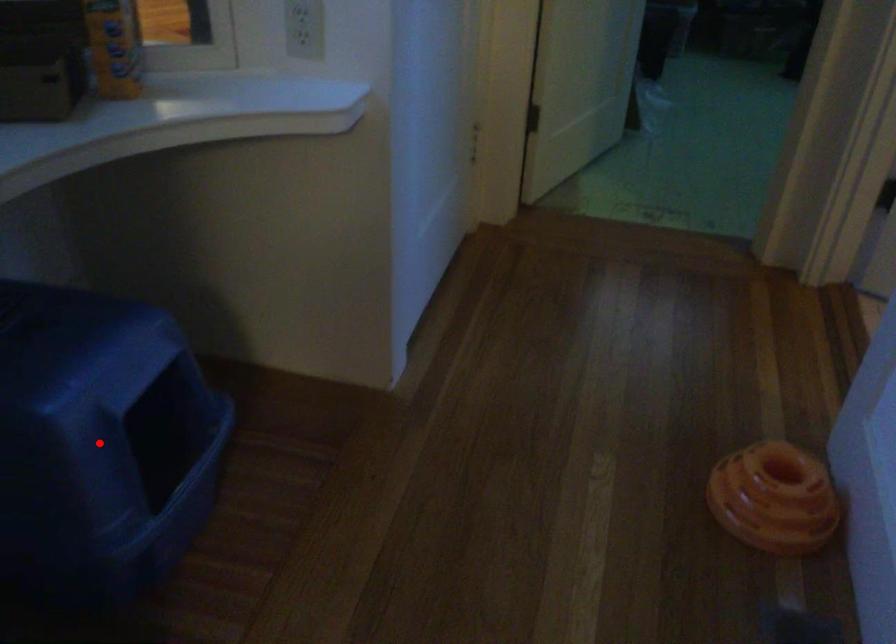
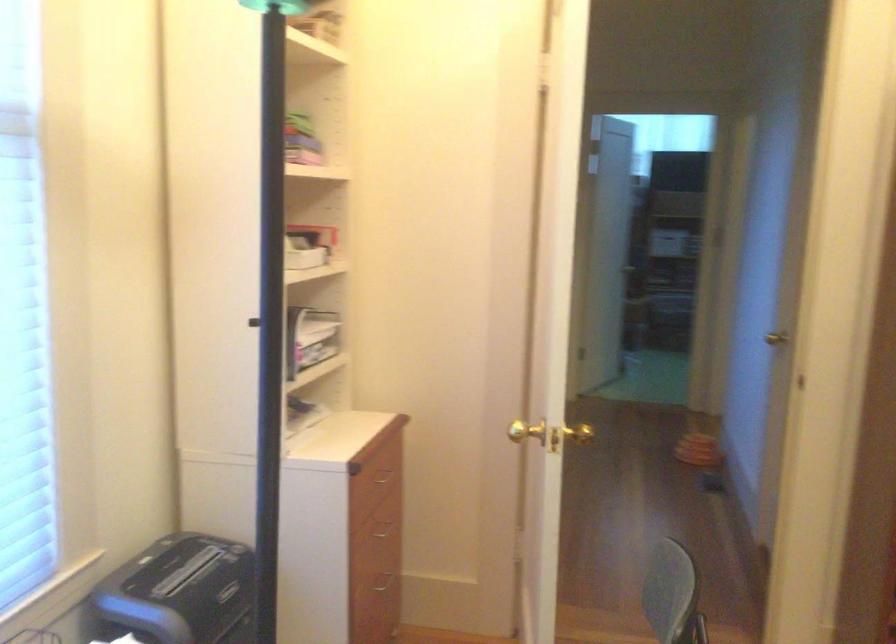
Question: I am providing you with two images of the same scene from different viewpoints. A red point is marked on the first image. Is the red point's position out of view in image 2?

Choices:
 (A) Yes
 (B) No

Answer: (A)